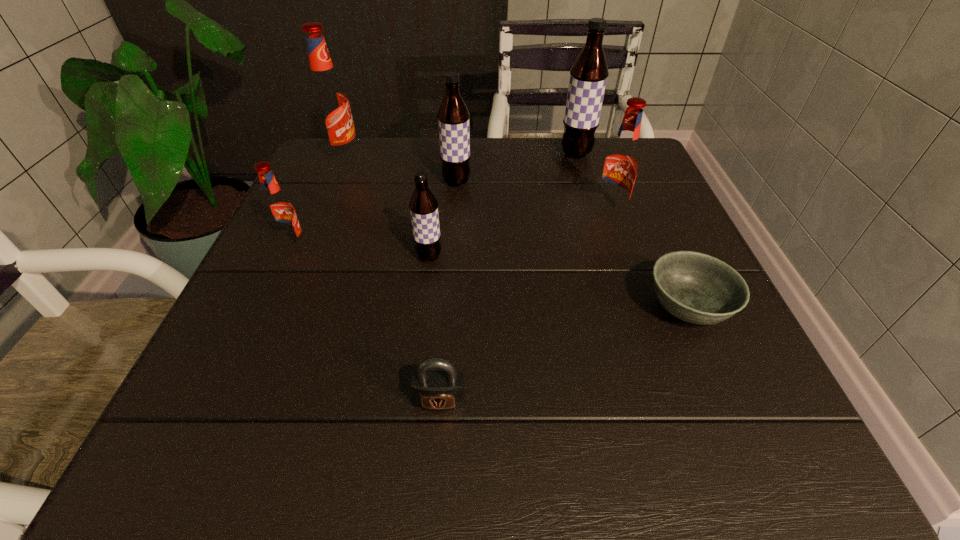
This screenshot has height=540, width=960. I want to click on the second shortest object, so tap(436, 385).

Identify the location of the second nearest object. The image size is (960, 540). (697, 288).

Locate an element on the screen. The width and height of the screenshot is (960, 540). the shortest object is located at coordinates (697, 288).

Where is `free location located 0.400m on the front of the farthest brown root beer`? This screenshot has height=540, width=960. free location located 0.400m on the front of the farthest brown root beer is located at coordinates (614, 282).

Identify the location of vacant space located 0.220m on the front of the farthest red root beer. (315, 226).

Locate an element on the screen. This screenshot has width=960, height=540. free space located on the left of the fourth farthest root beer is located at coordinates (569, 213).

This screenshot has height=540, width=960. I want to click on vacant space positioned 0.070m on the front of the second farthest brown root beer, so click(455, 210).

Identify the location of vacant space located 0.140m on the right of the smallest red root beer. (379, 247).

The image size is (960, 540). Identify the location of vacant area located on the back of the nearest brown root beer. (443, 144).

Find the location of a particular element. free space located on the front of the shortest object is located at coordinates (714, 371).